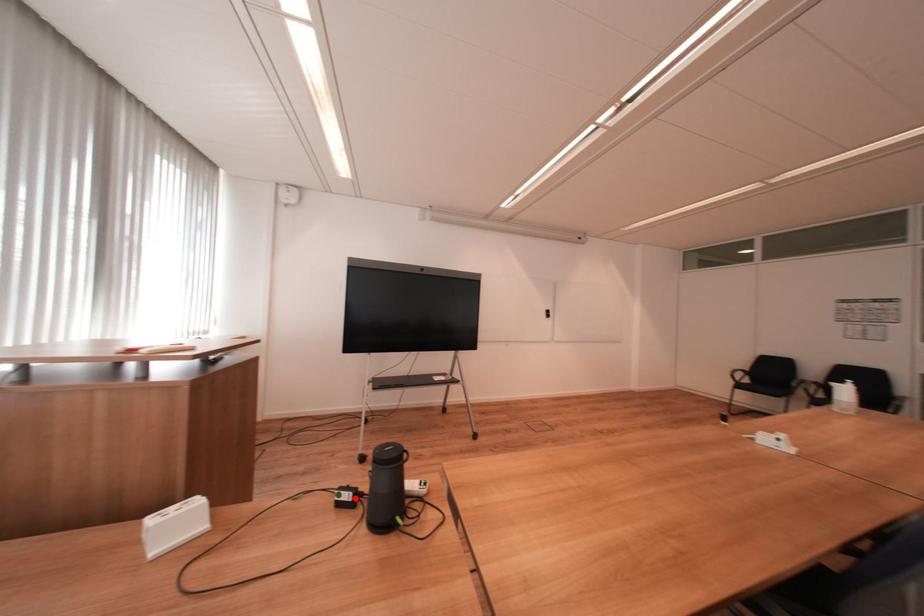
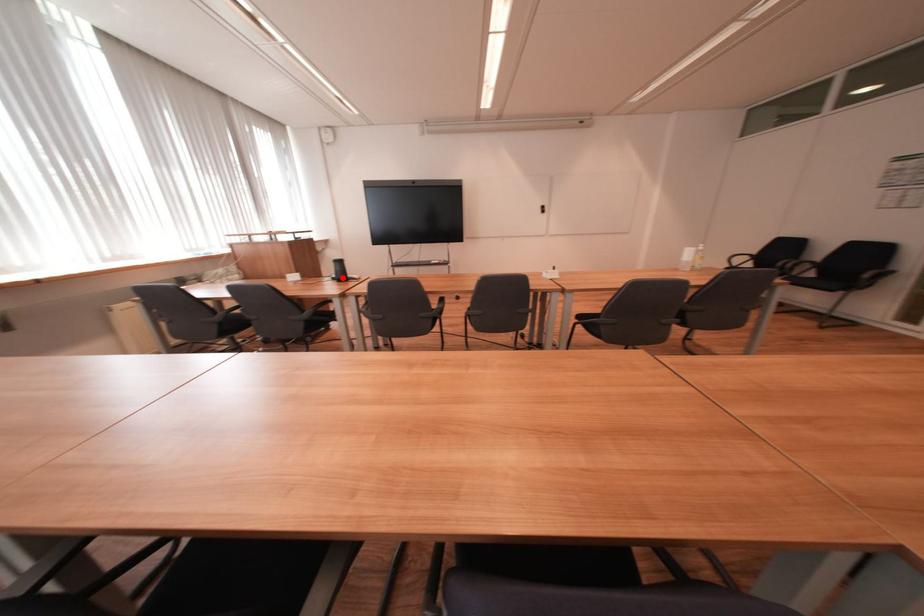
I am providing you with two images of the same scene from different viewpoints. A red point is marked on the first image and another point is marked on the second image. Does the point marked in image1 correspond to the same location as the one in image2?

Yes